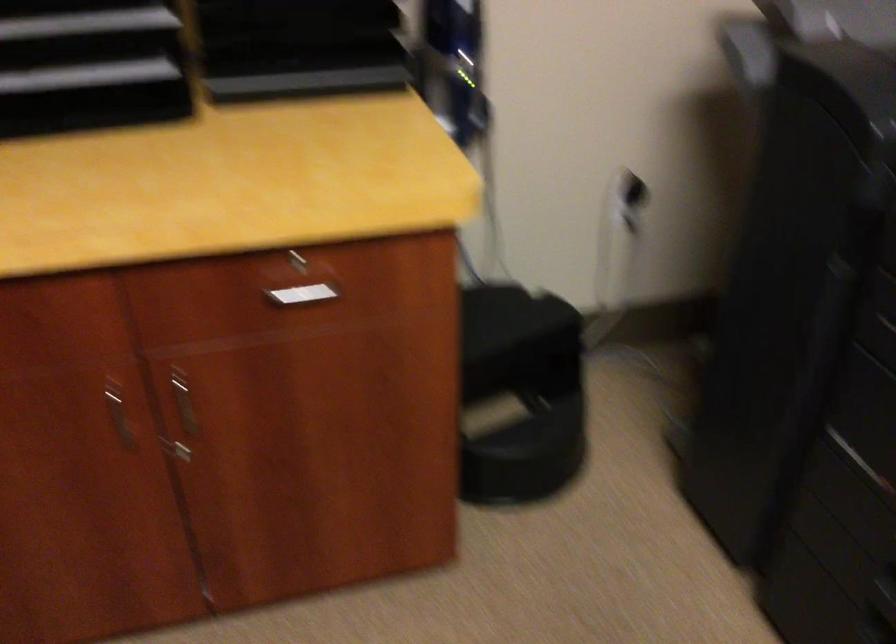
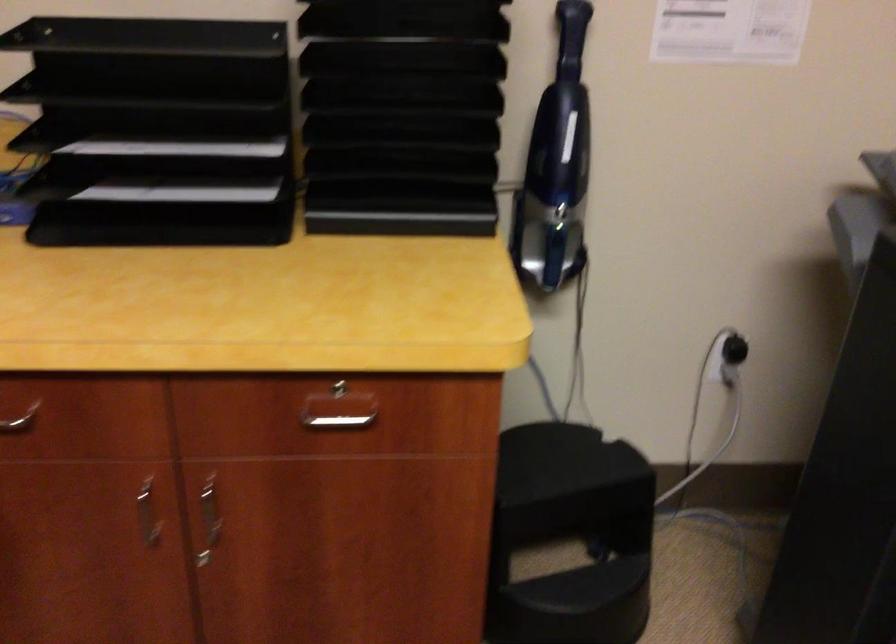
In the second image, find the point that corresponds to pixel 76 75 in the first image.

(183, 191)